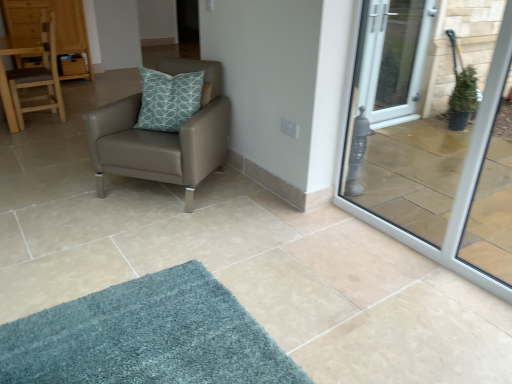
Question: Are matte brown leather chair at center, which appears as the 2th chair when viewed from the back, and wooden drawer at upper left making contact?

Choices:
 (A) yes
 (B) no

Answer: (B)

Question: Is the position of matte brown leather chair at center, which appears as the second chair when viewed from the left, more distant than that of wooden drawer at upper left?

Choices:
 (A) no
 (B) yes

Answer: (A)

Question: Is matte brown leather chair at center, which appears as the 2th chair when viewed from the back, bigger than wooden drawer at upper left?

Choices:
 (A) no
 (B) yes

Answer: (B)

Question: From a real-world perspective, is matte brown leather chair at center, which appears as the 2th chair when viewed from the back, positioned over wooden drawer at upper left based on gravity?

Choices:
 (A) no
 (B) yes

Answer: (B)

Question: Can you confirm if matte brown leather chair at center, positioned as the first chair in front-to-back order, is wider than wooden drawer at upper left?

Choices:
 (A) no
 (B) yes

Answer: (B)

Question: Can you confirm if matte brown leather chair at center, which appears as the 2th chair when viewed from the back, is positioned to the right of wooden drawer at upper left?

Choices:
 (A) no
 (B) yes

Answer: (B)

Question: Is light brown wooden chair at left, the 1th chair positioned from the back, facing towards wooden dresser at upper left?

Choices:
 (A) yes
 (B) no

Answer: (B)

Question: From a real-world perspective, does light brown wooden chair at left, positioned as the second chair in front-to-back order, stand above wooden dresser at upper left?

Choices:
 (A) yes
 (B) no

Answer: (B)

Question: Considering the relative positions of light brown wooden chair at left, the 2th chair in the right-to-left sequence, and wooden dresser at upper left in the image provided, is light brown wooden chair at left, the 2th chair in the right-to-left sequence, to the right of wooden dresser at upper left from the viewer's perspective?

Choices:
 (A) no
 (B) yes

Answer: (B)

Question: From the image's perspective, is light brown wooden chair at left, the 2th chair in the right-to-left sequence, located above wooden dresser at upper left?

Choices:
 (A) no
 (B) yes

Answer: (A)

Question: Is light brown wooden chair at left, the 2th chair in the right-to-left sequence, located outside wooden dresser at upper left?

Choices:
 (A) no
 (B) yes

Answer: (B)

Question: Is light brown wooden chair at left, the 1th chair positioned from the back, closer to camera compared to wooden dresser at upper left?

Choices:
 (A) no
 (B) yes

Answer: (B)

Question: Can you confirm if wooden dresser at upper left is positioned to the left of matte brown leather chair at center, which appears as the second chair when viewed from the left?

Choices:
 (A) no
 (B) yes

Answer: (B)